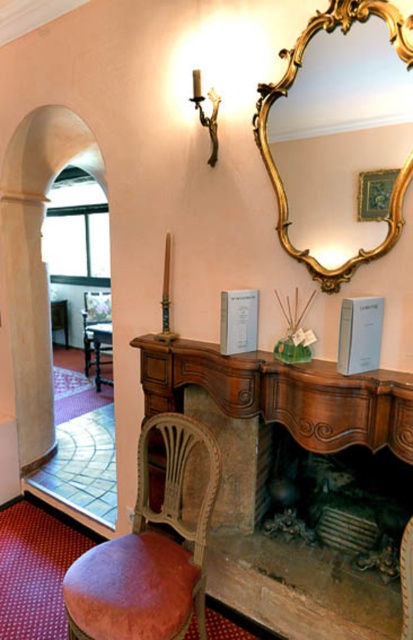
You are arranging a photo shoot in this room and need to place a large camera tripod between the wooden fireplace at center and the green fabric picture frame at upper center. Based on their positions, which object should the tripod be closer to?

The wooden fireplace at center is positioned on the left side of green fabric picture frame at upper center, so the tripod should be placed closer to the wooden fireplace at center since it is to the left of the picture frame.

You are a visitor entering the room and want to sit down. Which object, the wooden armchair at left or the green fabric picture frame at upper center, is a better option for seating?

The wooden armchair at left is a better option for seating because it is much taller than the green fabric picture frame at upper center, indicating it is designed for sitting.